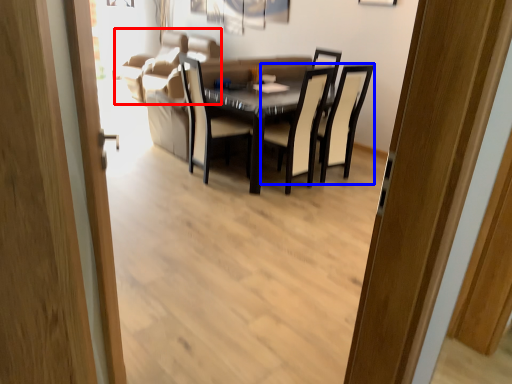
Question: Which of the following is the closest to the observer, couch (highlighted by a red box) or chair (highlighted by a blue box)?

Choices:
 (A) couch
 (B) chair

Answer: (B)